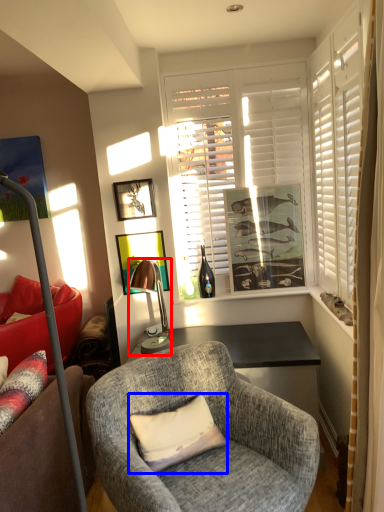
Question: Which object appears farthest to the camera in this image, lamp (highlighted by a red box) or pillow (highlighted by a blue box)?

Choices:
 (A) lamp
 (B) pillow

Answer: (A)